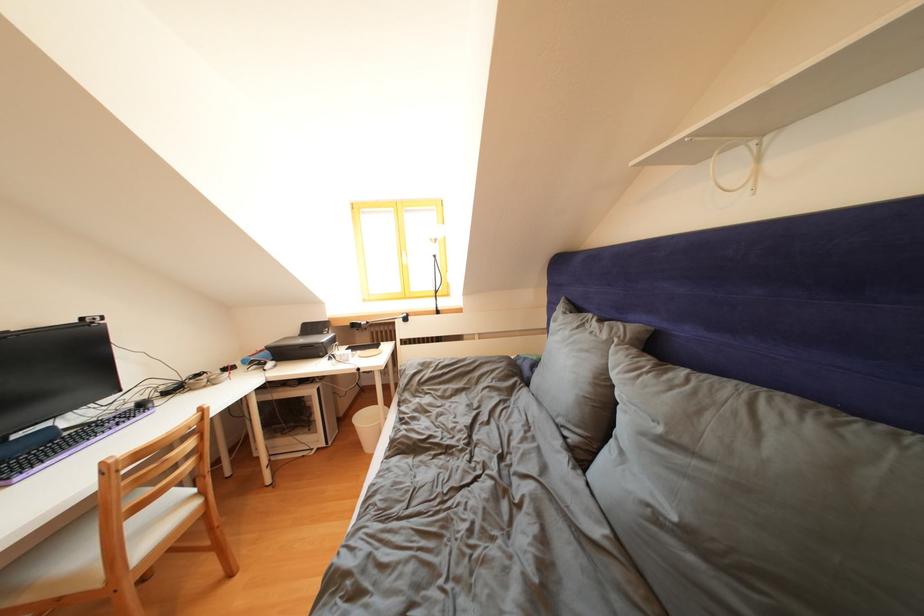
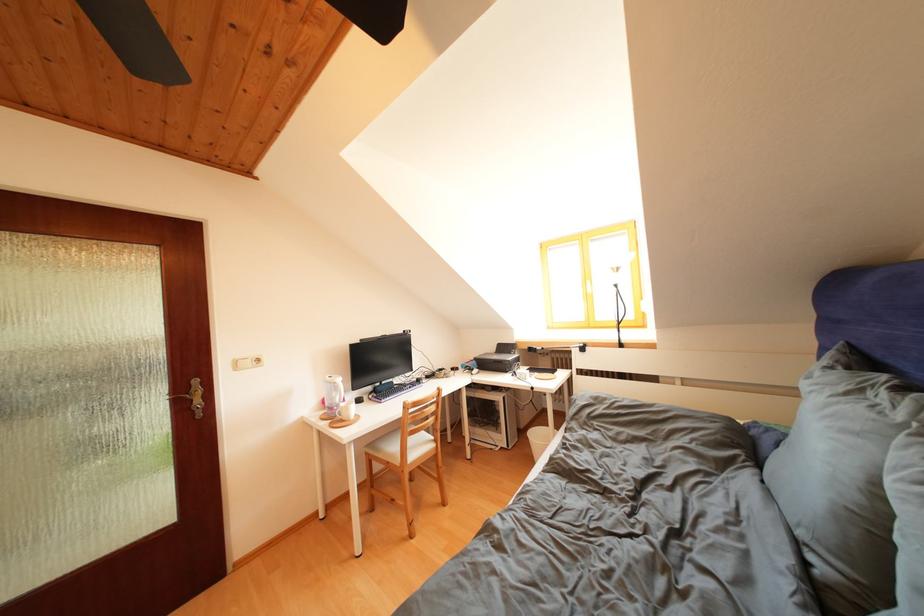
Find the pixel in the second image that matches pixel 329 338 in the first image.

(517, 358)